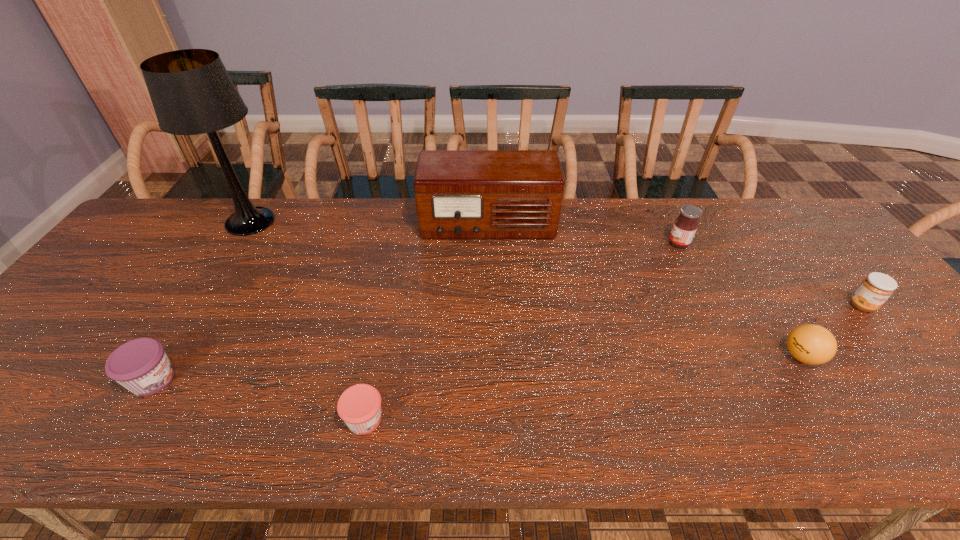
Where is `vacant space located on the front label of the leftmost jam`? vacant space located on the front label of the leftmost jam is located at coordinates (334, 380).

At what (x,y) coordinates should I click in order to perform the action: click on free location located 0.130m on the front label of the third jam from right to left. Please return your answer as a coordinate pair (x, y). This screenshot has height=540, width=960. Looking at the image, I should click on (448, 419).

Where is `table lamp located in the far edge section of the desktop`? The height and width of the screenshot is (540, 960). table lamp located in the far edge section of the desktop is located at coordinates (192, 93).

Locate an element on the screen. The width and height of the screenshot is (960, 540). radio receiver at the far edge is located at coordinates (460, 194).

Where is `jam positioned at the far edge`? Image resolution: width=960 pixels, height=540 pixels. jam positioned at the far edge is located at coordinates (685, 226).

Find the location of a particular element. The image size is (960, 540). object located in the near edge section of the desktop is located at coordinates (359, 406).

The width and height of the screenshot is (960, 540). What are the coordinates of `object located at the right edge` in the screenshot? It's located at (875, 289).

Locate an element on the screen. vacant space at the far edge of the desktop is located at coordinates (593, 211).

Identify the location of free space at the near edge of the desktop. coord(684,414).

Locate an element on the screen. vacant space at the right edge of the desktop is located at coordinates (849, 262).